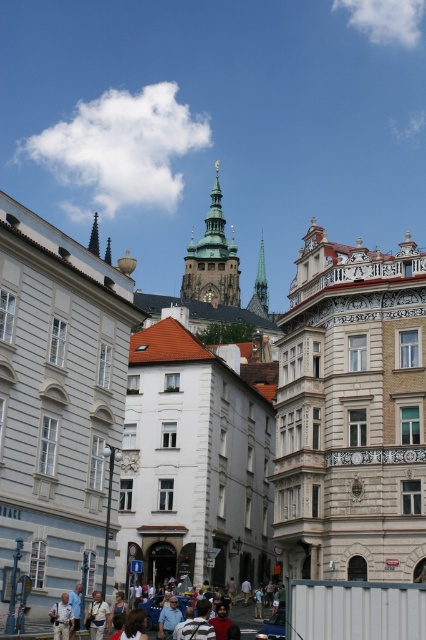
You are standing at the point with coordinates point (184, 284) and want to walk to the point with coordinates point (342, 410). Which direction should you move in order to reach your destination?

You should move forward because point (342, 410) is in front of point (184, 284).